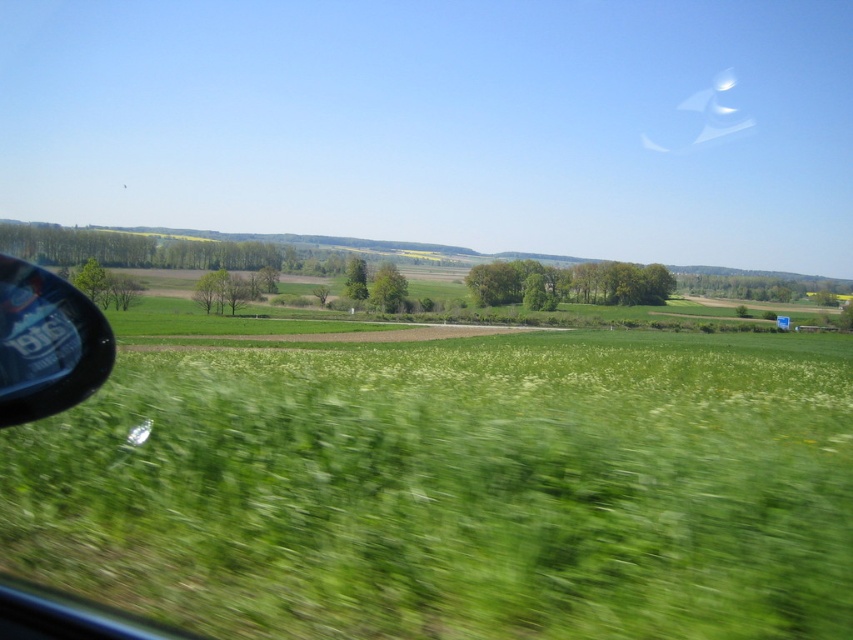
Can you confirm if green grass at lower left is taller than transparent plastic side mirror at lower left?

No, green grass at lower left is not taller than transparent plastic side mirror at lower left.

Who is lower down, green grass at lower left or transparent plastic side mirror at lower left?

green grass at lower left

Does point (453, 483) come closer to viewer compared to point (26, 397)?

That is True.

Image resolution: width=853 pixels, height=640 pixels. Find the location of `green grass at lower left`. green grass at lower left is located at coordinates tap(454, 490).